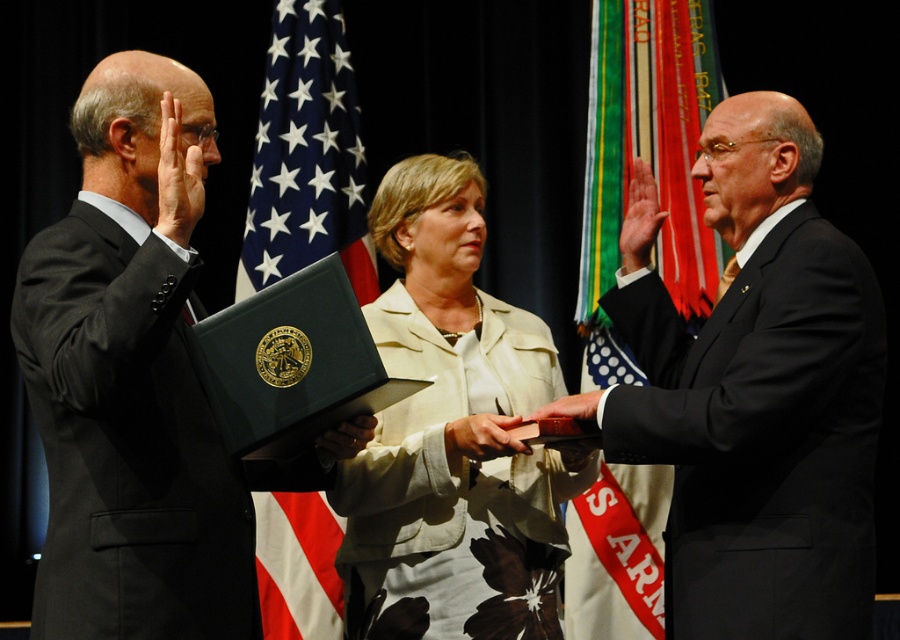
Question: Considering the relative positions of black suit at center and beige fabric jacket at center in the image provided, where is black suit at center located with respect to beige fabric jacket at center?

Choices:
 (A) right
 (B) left

Answer: (A)

Question: Which object is closer to the camera taking this photo?

Choices:
 (A) black suit at left
 (B) black suit at center
 (C) beige fabric jacket at center
 (D) blue fabric flag at center

Answer: (A)

Question: Considering the relative positions of black suit at center and beige fabric jacket at center in the image provided, where is black suit at center located with respect to beige fabric jacket at center?

Choices:
 (A) right
 (B) left

Answer: (A)

Question: Among these points, which one is nearest to the camera?

Choices:
 (A) (534, 573)
 (B) (833, 298)
 (C) (245, 240)
 (D) (684, 250)

Answer: (B)

Question: Which point is closer to the camera taking this photo?

Choices:
 (A) (334, 214)
 (B) (731, 531)

Answer: (B)

Question: Does black suit at left lie in front of blue fabric flag at center?

Choices:
 (A) yes
 (B) no

Answer: (A)